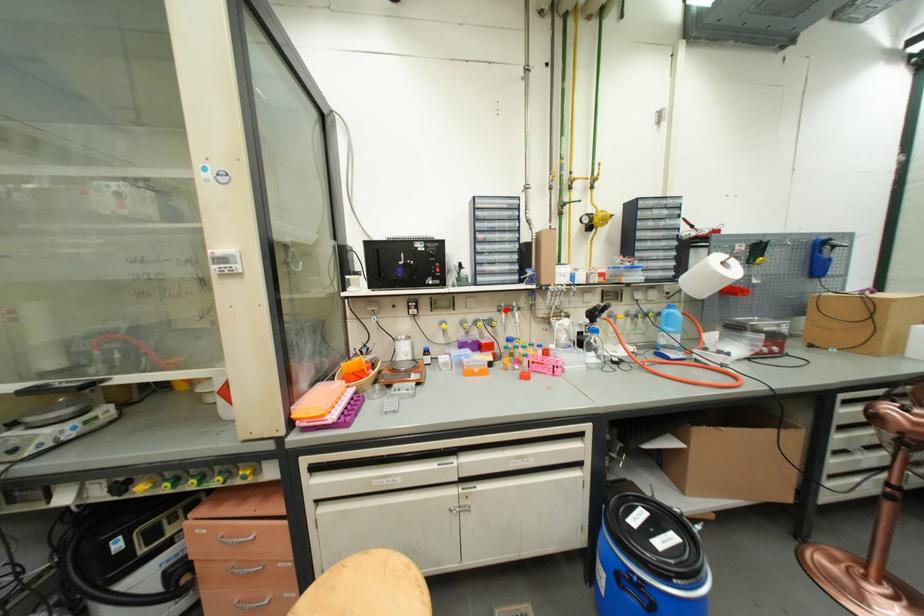
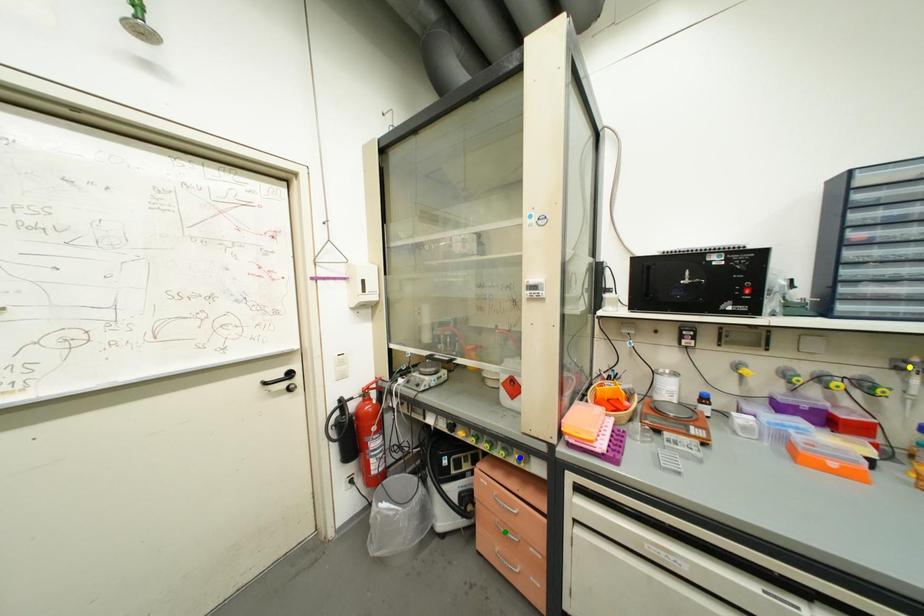
Question: I am providing you with two images of the same scene from different viewpoints. A red point is marked on the first image. You are given multiple points on the second image. Which spot in image 2 lines up with the point in image 1?

Choices:
 (A) yellow point
 (B) blue point
 (C) green point

Answer: (A)